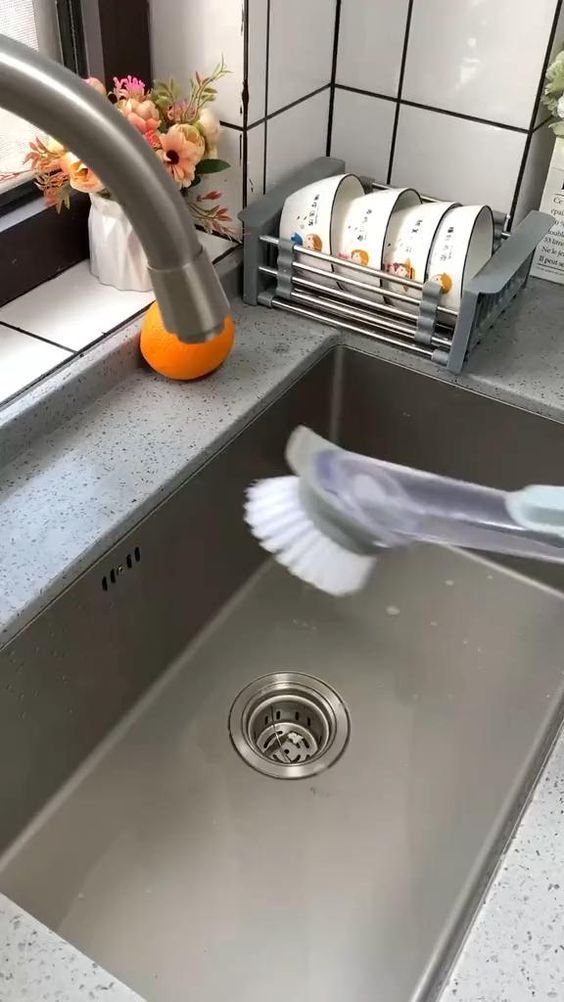
This screenshot has width=564, height=1002. I want to click on sink, so click(x=381, y=879).